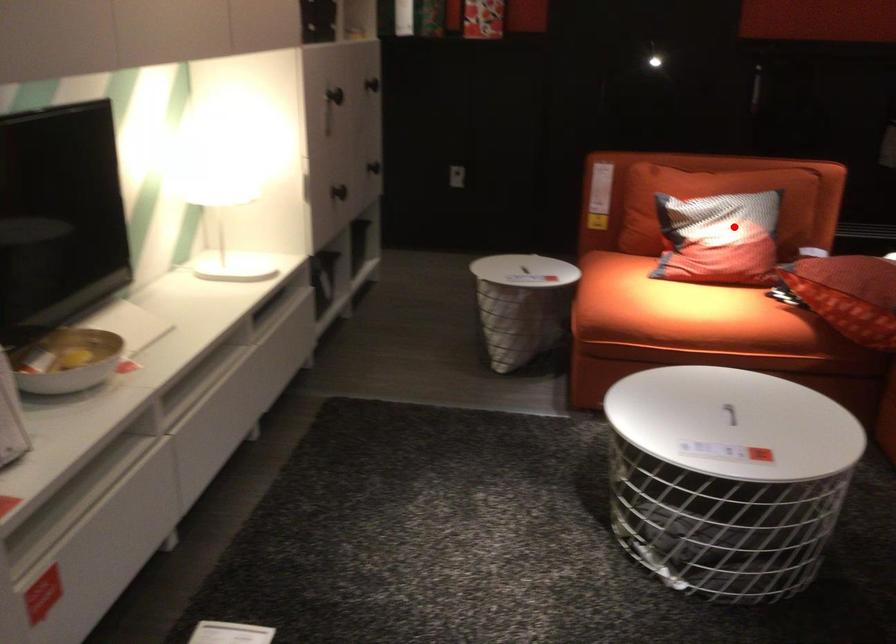
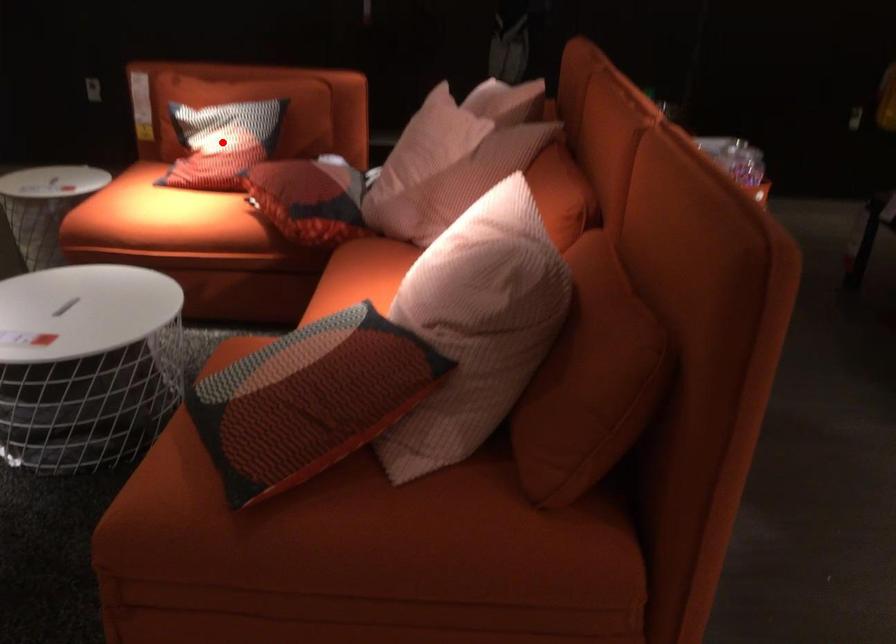
I am providing you with two images of the same scene from different viewpoints. A red point is marked on the first image and another point is marked on the second image. Do the highlighted points in image1 and image2 indicate the same real-world spot?

Yes